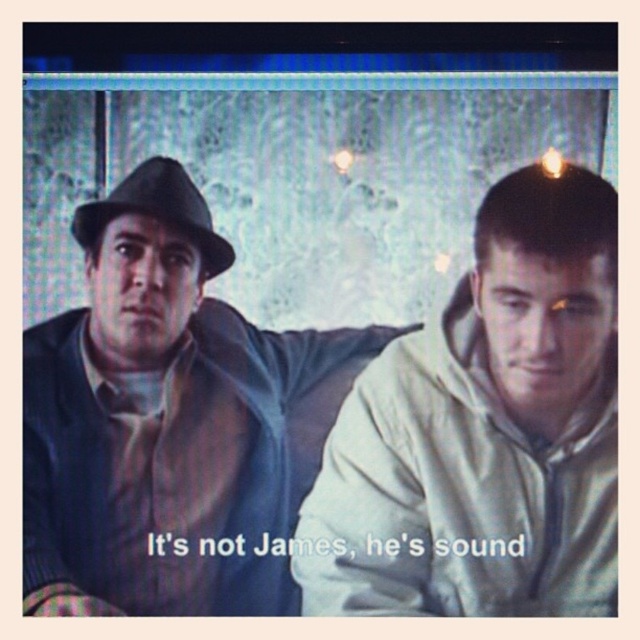
Who is shorter, matte brown leather jacket at left or matte black fedora at left?

matte black fedora at left

Based on the photo, can you confirm if matte brown leather jacket at left is shorter than matte black fedora at left?

Incorrect, matte brown leather jacket at left's height does not fall short of matte black fedora at left's.

Which is in front, point (122, 307) or point (205, 209)?

Positioned in front is point (122, 307).

This screenshot has width=640, height=640. What are the coordinates of `matte brown leather jacket at left` in the screenshot? It's located at click(x=170, y=422).

Does point (204, 433) come closer to viewer compared to point (513, 436)?

No, it is not.

Identify the location of matte brown leather jacket at left. (170, 422).

Does point (108, 269) come closer to viewer compared to point (509, 218)?

Yes, it is in front of point (509, 218).

This screenshot has width=640, height=640. Identify the location of matte brown leather jacket at left. (170, 422).

Can you confirm if white matte hoodie at right is smaller than matte black fedora at left?

No, white matte hoodie at right is not smaller than matte black fedora at left.

Find the location of `white matte hoodie at right`. white matte hoodie at right is located at coordinates (484, 432).